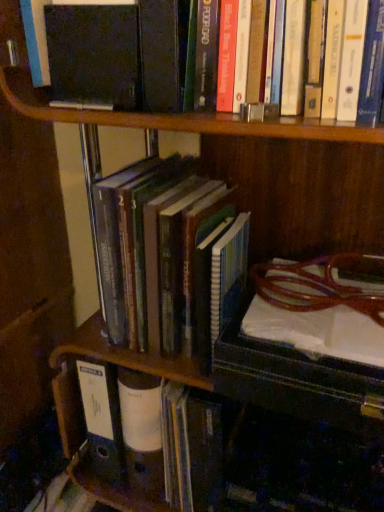
Question: Considering the relative positions of hardcover book at center, which is the second book from top to bottom, and hardcover books at center, which is the 1th book in top-to-bottom order, in the image provided, is hardcover book at center, which is the second book from top to bottom, to the left or to the right of hardcover books at center, which is the 1th book in top-to-bottom order,?

Choices:
 (A) left
 (B) right

Answer: (A)

Question: From a real-world perspective, is hardcover book at center, which is the second book from top to bottom, positioned above or below hardcover books at center, which is the 1th book in top-to-bottom order?

Choices:
 (A) above
 (B) below

Answer: (B)

Question: From the image's perspective, is hardcover book at center, which ranks as the first book in bottom-to-top order, located above or below hardcover books at center, which is the 1th book in top-to-bottom order?

Choices:
 (A) above
 (B) below

Answer: (B)

Question: Is hardcover books at center, the second book positioned from the bottom, taller or shorter than hardcover book at center, which is the second book from top to bottom?

Choices:
 (A) tall
 (B) short

Answer: (A)

Question: Based on their positions, is hardcover books at center, which is the 1th book in top-to-bottom order, located to the left or right of hardcover book at center, which is the second book from top to bottom?

Choices:
 (A) right
 (B) left

Answer: (A)

Question: Is hardcover books at center, which is the 1th book in top-to-bottom order, bigger or smaller than hardcover book at center, which ranks as the first book in bottom-to-top order?

Choices:
 (A) big
 (B) small

Answer: (A)

Question: Is hardcover books at center, which is the 1th book in top-to-bottom order, spatially inside hardcover book at center, which ranks as the first book in bottom-to-top order, or outside of it?

Choices:
 (A) inside
 (B) outside

Answer: (B)